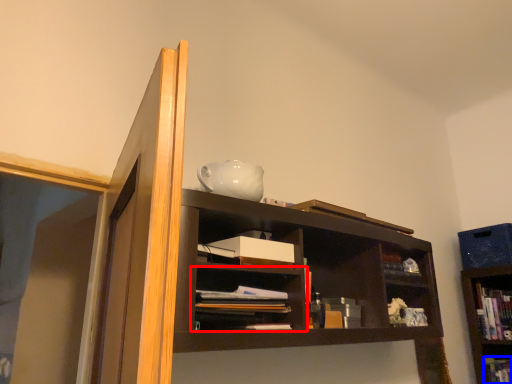
Question: Among these objects, which one is farthest to the camera, shelf (highlighted by a red box) or book (highlighted by a blue box)?

Choices:
 (A) shelf
 (B) book

Answer: (B)